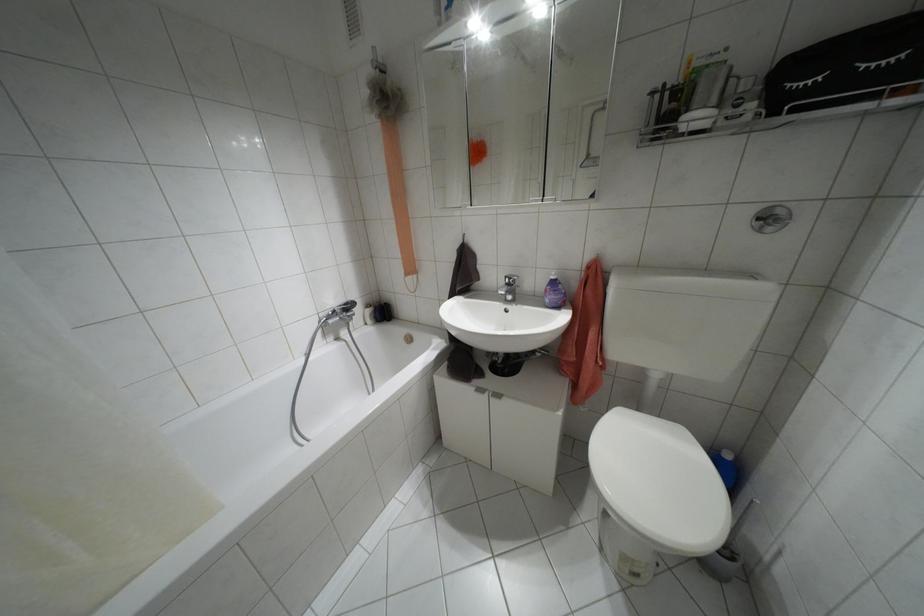
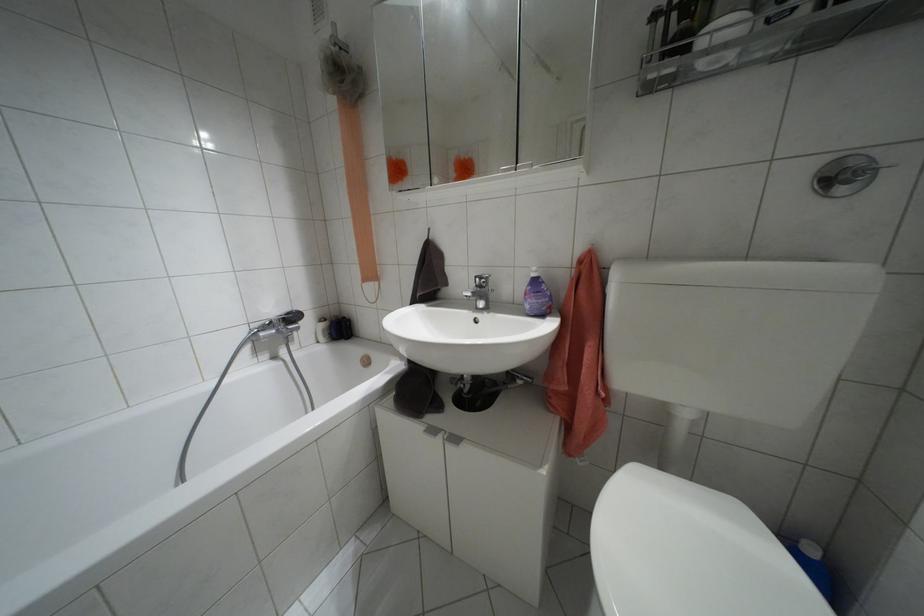
Find the pixel in the second image that matches point (769, 228) in the first image.

(841, 190)